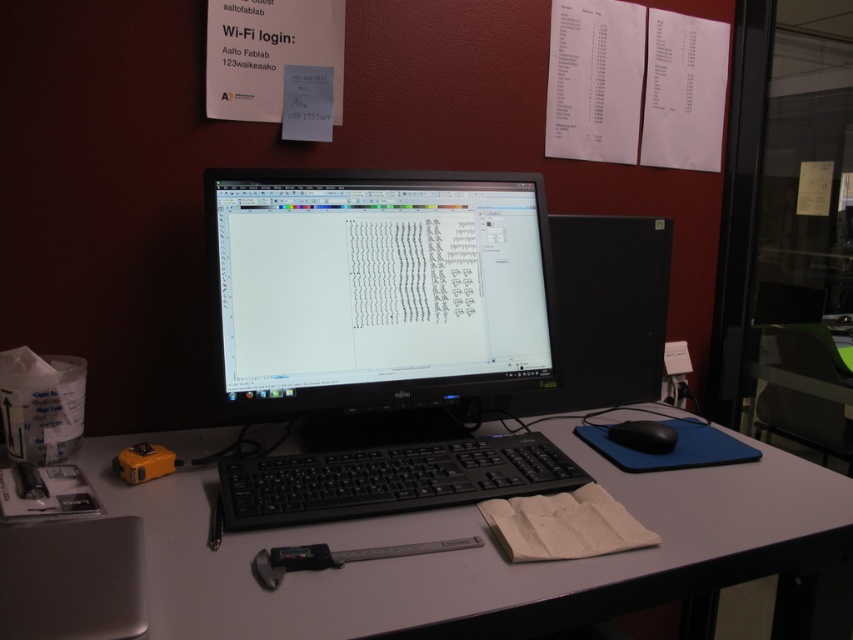
You are an engineer working on a project and need to access both the black matte monitor at center and the silver metallic caliper at center. Which object is closer to you if you are sitting at the desk?

The black matte monitor at center is closer to you because the silver metallic caliper at center is behind it, placing the monitor in front.

What object is located at the coordinates point (602, 314)?

The point (602, 314) indicates the black matte computer monitor at right.